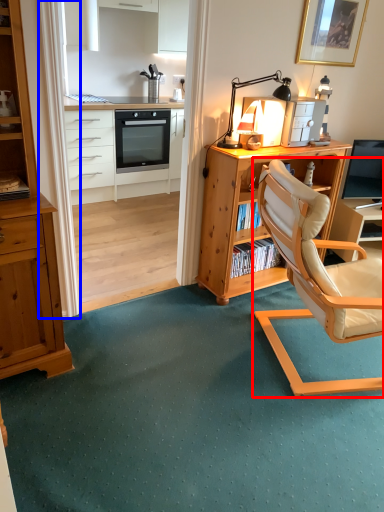
Question: Which of the following is the closest to the observer, chair (highlighted by a red box) or curtain (highlighted by a blue box)?

Choices:
 (A) chair
 (B) curtain

Answer: (A)